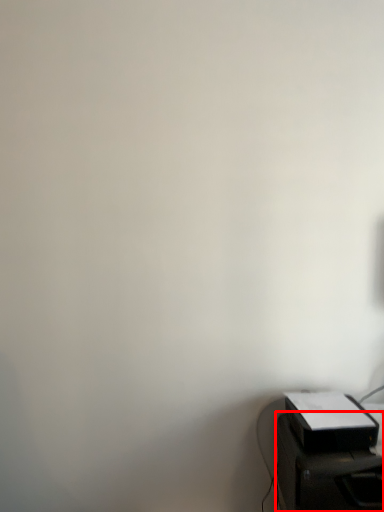
Question: From the image's perspective, where is furniture (annotated by the red box) located relative to printer?

Choices:
 (A) below
 (B) above

Answer: (A)